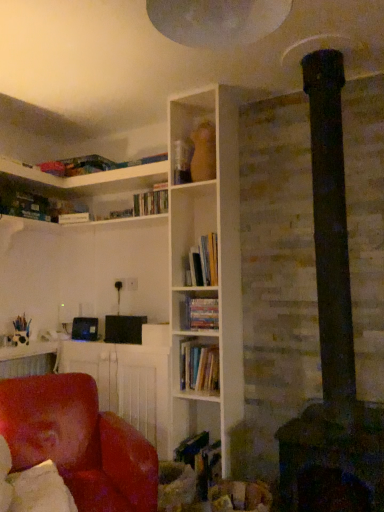
Question: From a real-world perspective, is matte red chair at lower left above or below leather at left?

Choices:
 (A) below
 (B) above

Answer: (B)

Question: Is point (104, 368) positioned closer to the camera than point (114, 420)?

Choices:
 (A) closer
 (B) farther

Answer: (B)

Question: Which object is the farthest from the hardcover books at center, the third book when ordered from top to bottom?

Choices:
 (A) hardcover books at center, which ranks as the second book in top-to-bottom order
 (B) leather at left
 (C) matte red chair at lower left
 (D) hardcover books at center, acting as the first book starting from the top

Answer: (B)

Question: Which object is the farthest from the leather at left?

Choices:
 (A) hardcover books at center, which ranks as the second book in top-to-bottom order
 (B) hardcover books at center, acting as the first book starting from the top
 (C) hardcover books at center, the first book in the bottom-to-top sequence
 (D) matte red chair at lower left

Answer: (B)